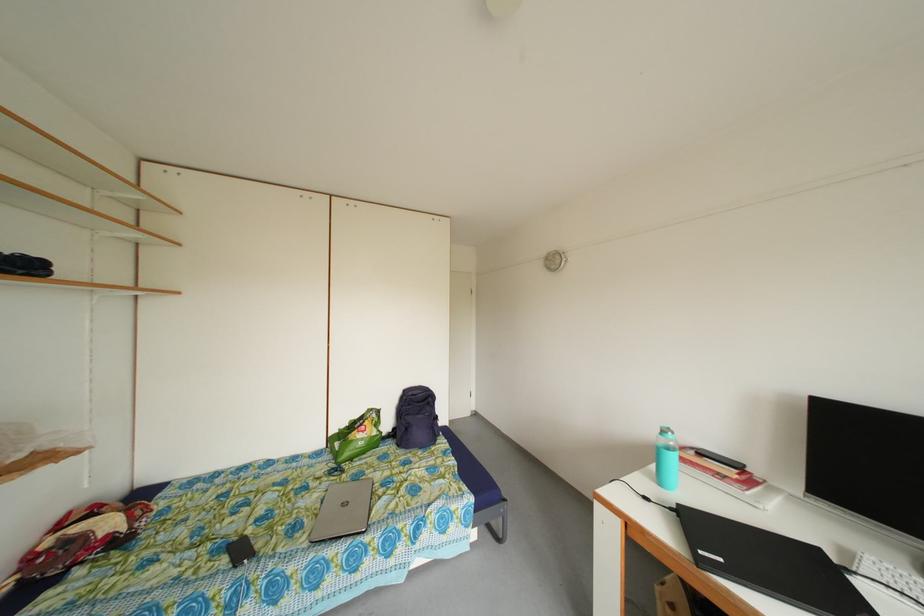
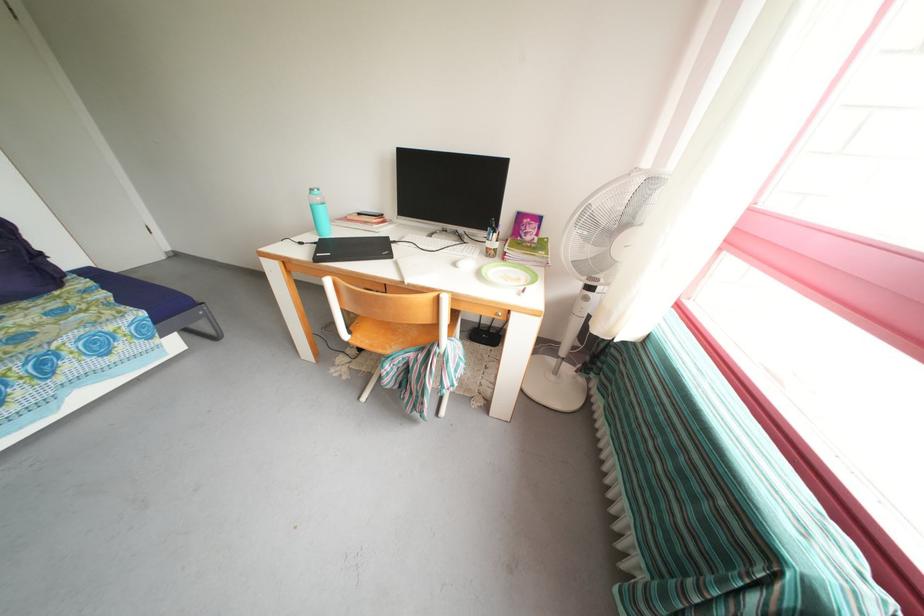
In the second image, find the point that corresponds to point 671,438 in the first image.

(319, 196)